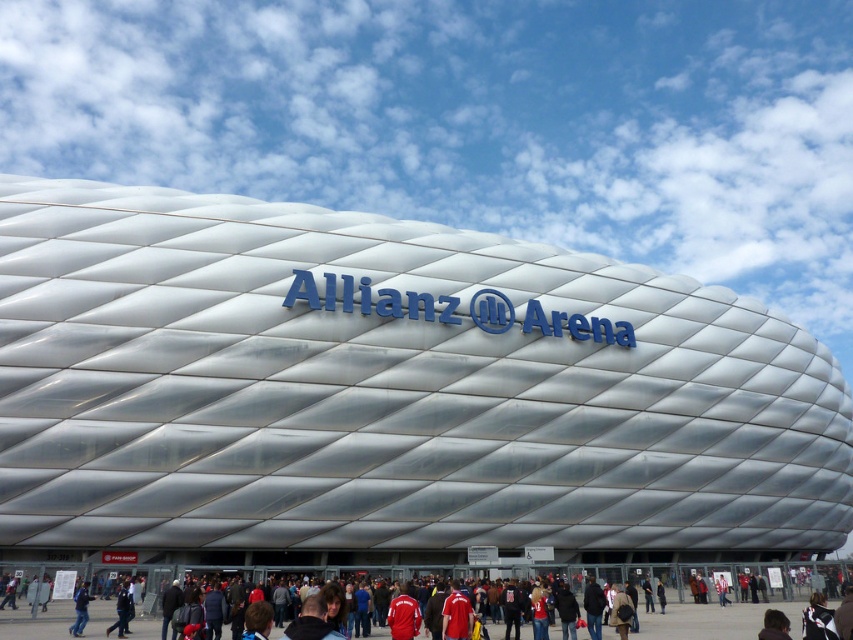
Who is higher up, red fabric jacket at center or blue fabric jacket at lower left?

Positioned higher is blue fabric jacket at lower left.

Can you confirm if red fabric jacket at center is positioned to the left of blue fabric jacket at lower left?

No, red fabric jacket at center is not to the left of blue fabric jacket at lower left.

Does point (619, 572) lie behind point (79, 616)?

That is True.

At what (x,y) coordinates should I click in order to perform the action: click on red fabric jacket at center. Please return your answer as a coordinate pair (x, y). Looking at the image, I should click on (706, 582).